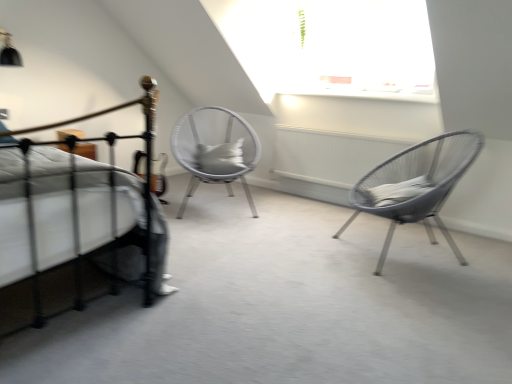
Find the location of `free space that is to the left of metallic wire chair at right, the 2th chair in the back-to-front sequence`. free space that is to the left of metallic wire chair at right, the 2th chair in the back-to-front sequence is located at coordinates (305, 245).